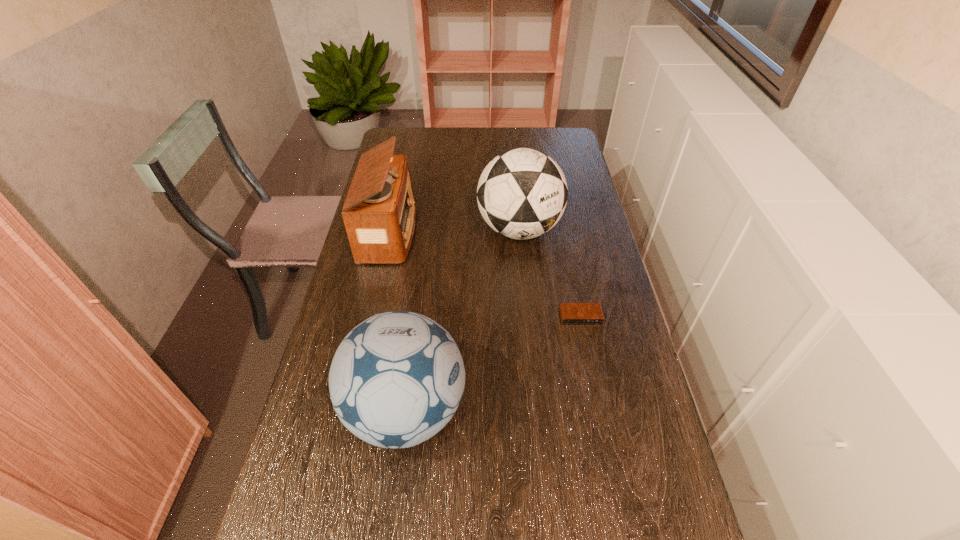
Locate an element on the screen. This screenshot has width=960, height=540. unoccupied area between the radio receiver and the right soccer ball is located at coordinates (454, 231).

The width and height of the screenshot is (960, 540). What are the coordinates of `free area in between the radio receiver and the alarm clock` in the screenshot? It's located at (485, 275).

Locate an element on the screen. This screenshot has width=960, height=540. empty space that is in between the right soccer ball and the alarm clock is located at coordinates (550, 273).

Locate an element on the screen. Image resolution: width=960 pixels, height=540 pixels. free spot between the farther soccer ball and the radio receiver is located at coordinates (454, 231).

Identify the location of empty space between the nearer soccer ball and the shortest object. (493, 364).

Where is `object identified as the second closest to the shortest object`? object identified as the second closest to the shortest object is located at coordinates (397, 378).

The width and height of the screenshot is (960, 540). In order to click on the third closest object to the right soccer ball in this screenshot , I will do `click(397, 378)`.

At what (x,y) coordinates should I click in order to perform the action: click on free space that satisfies the following two spatial constraints: 1. on the surface of the right soccer ball where the brand logo is visible; 2. on the side with brand of the nearest object. Please return your answer as a coordinate pair (x, y). The image size is (960, 540). Looking at the image, I should click on (537, 410).